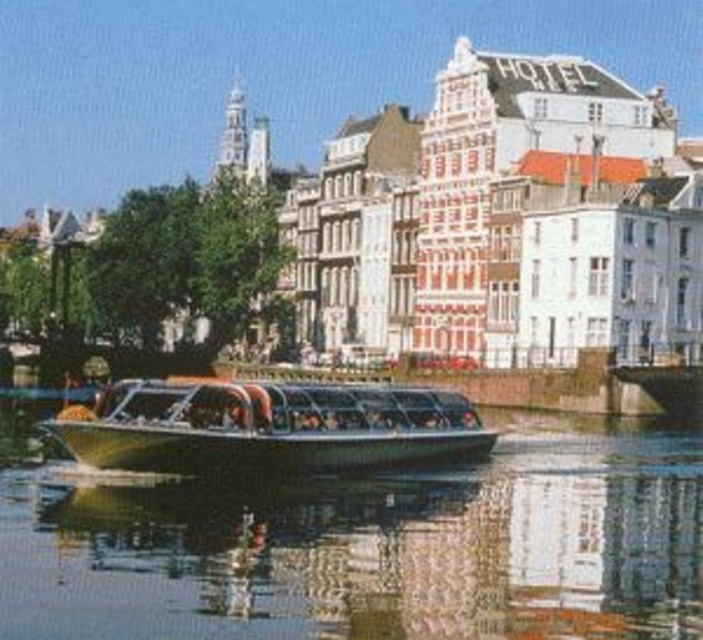
Question: Does metallic gray boat at center appear over metallic glass boat at center?

Choices:
 (A) no
 (B) yes

Answer: (A)

Question: Can you confirm if metallic gray boat at center is positioned to the right of metallic glass boat at center?

Choices:
 (A) yes
 (B) no

Answer: (A)

Question: Is metallic gray boat at center to the right of metallic glass boat at center from the viewer's perspective?

Choices:
 (A) yes
 (B) no

Answer: (A)

Question: Which point appears closest to the camera in this image?

Choices:
 (A) (302, 426)
 (B) (247, 528)

Answer: (B)

Question: Which point is farther from the camera taking this photo?

Choices:
 (A) (250, 445)
 (B) (22, 476)

Answer: (B)